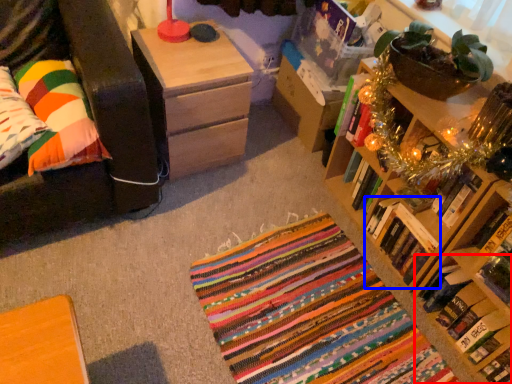
Question: Among these objects, which one is farthest to the camera, book (highlighted by a red box) or book (highlighted by a blue box)?

Choices:
 (A) book
 (B) book

Answer: (B)